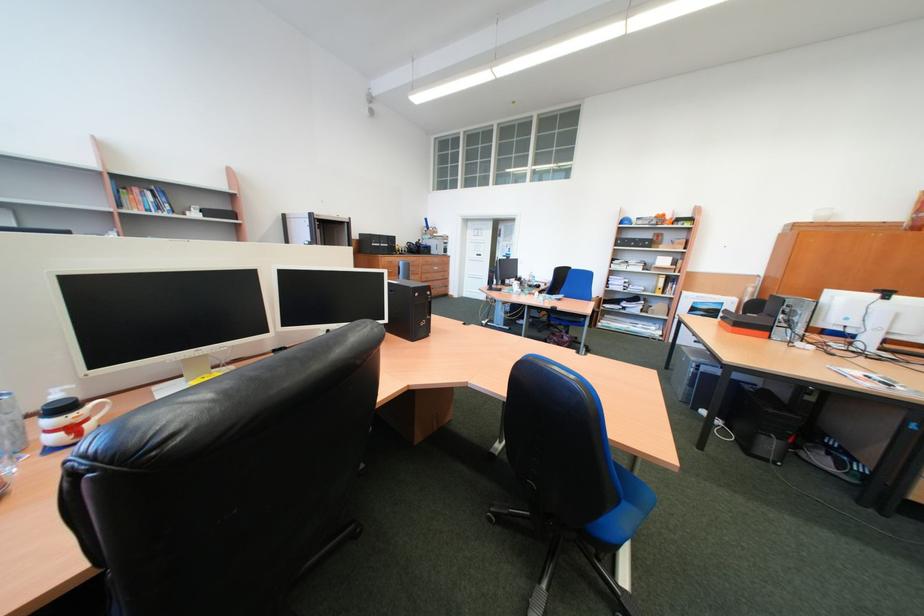
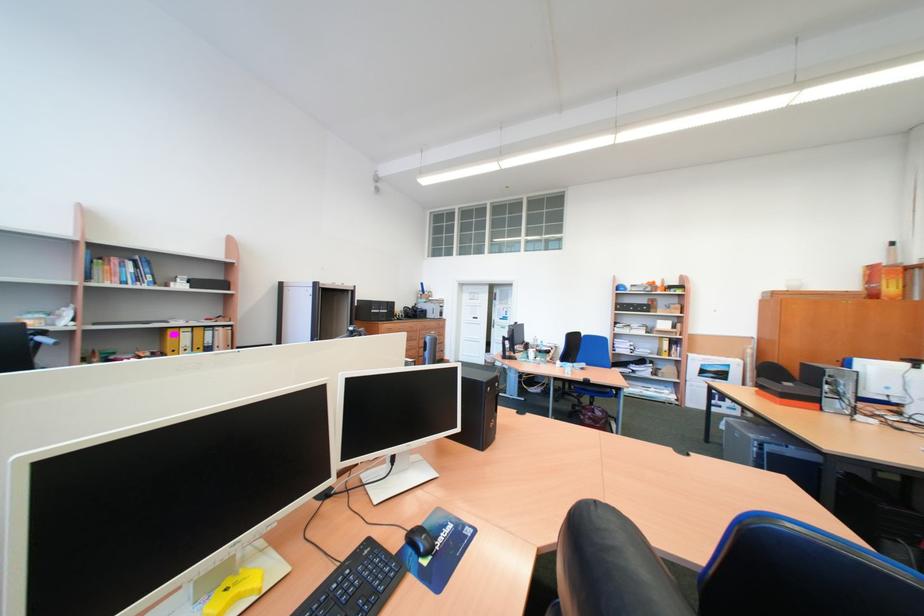
Question: The images are taken continuously from a first-person perspective. In which direction is your viewpoint rotating?

Choices:
 (A) Left
 (B) Right
 (C) Up
 (D) Down

Answer: (C)